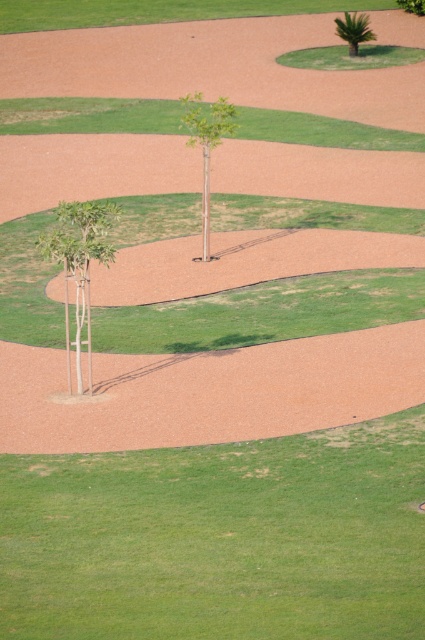
You are designing a garden layout and need to place a new bench between the green matte tree at lower left and the green leafy palm at upper center. Considering their widths, which tree should the bench be placed closer to for better balance?

The green matte tree at lower left has a larger width than the green leafy palm at upper center, so the bench should be placed closer to the green leafy palm at upper center to achieve better balance.

You are standing in the landscaped area and want to plant a new flower bed between the green matte tree at center and the green leafy palm at upper center. Based on their positions, which tree should you place the flowers closer to?

You should place the flowers closer to the green leafy palm at upper center because the green matte tree at center is to the left of it, meaning the palm is positioned further to the right.